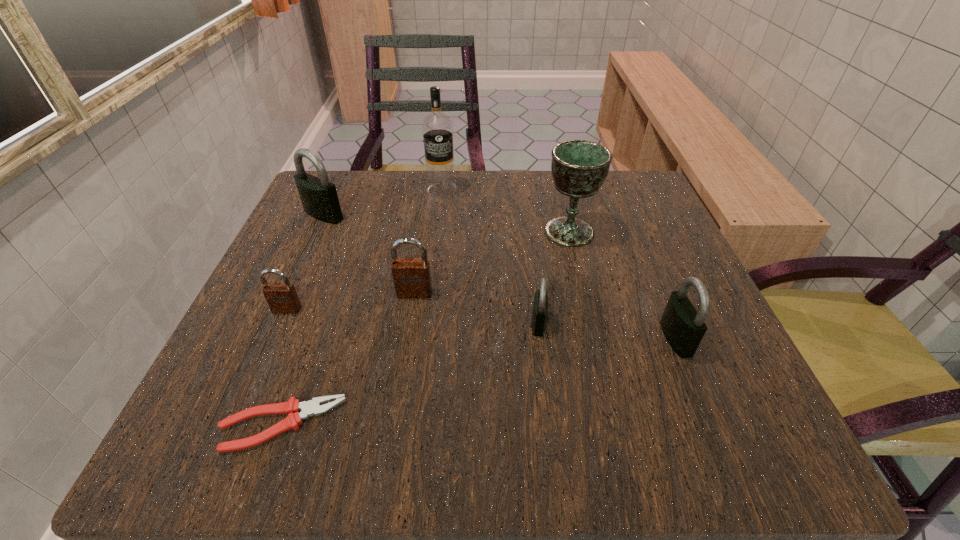
Where is `vacant area that lies between the nearer brown padlock and the third padlock from left to right`? vacant area that lies between the nearer brown padlock and the third padlock from left to right is located at coordinates (350, 301).

Where is `free space between the biggest black padlock and the second black padlock from right to left`? free space between the biggest black padlock and the second black padlock from right to left is located at coordinates (431, 269).

The height and width of the screenshot is (540, 960). In order to click on free area in between the left brown padlock and the bigger brown padlock in this screenshot , I will do `click(350, 301)`.

Identify the location of vacant space in between the tallest object and the smaller brown padlock. The width and height of the screenshot is (960, 540). (364, 249).

Where is `free space between the nearer brown padlock and the sixth object from left to right`? free space between the nearer brown padlock and the sixth object from left to right is located at coordinates (413, 316).

Where is `vacant point located between the farther brown padlock and the nearer brown padlock`? Image resolution: width=960 pixels, height=540 pixels. vacant point located between the farther brown padlock and the nearer brown padlock is located at coordinates (350, 301).

Identify the location of vacant space in between the leftmost black padlock and the tallest object. (383, 202).

I want to click on free spot between the chalice and the bigger brown padlock, so click(492, 262).

Locate which object is the fifth closest to the nearest object. Please provide its 2D coordinates. Your answer should be formatted as a tuple, i.e. [(x, y)], where the tuple contains the x and y coordinates of a point satisfying the conditions above.

[(579, 167)]

I want to click on object that ranks as the seventh closest to the vodka, so click(x=292, y=407).